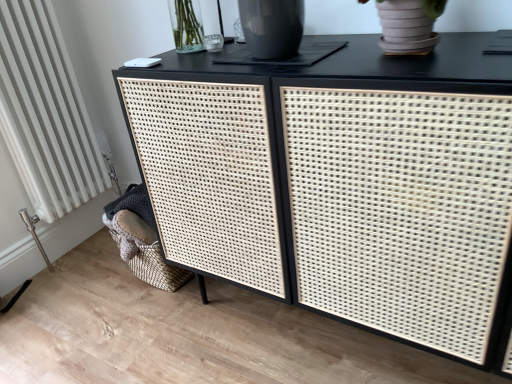
Image resolution: width=512 pixels, height=384 pixels. Describe the element at coordinates (341, 183) in the screenshot. I see `black woven cabinet at center` at that location.

Find the location of a particular element. This screenshot has width=512, height=384. black woven cabinet at center is located at coordinates (341, 183).

Measure the distance between point (481, 173) and camera.

They are 75.90 centimeters apart.

Where is `white textured radiator at lower left`? The width and height of the screenshot is (512, 384). white textured radiator at lower left is located at coordinates (45, 112).

The height and width of the screenshot is (384, 512). Describe the element at coordinates (45, 112) in the screenshot. I see `white textured radiator at lower left` at that location.

Find the location of `black woven cabinet at center`. black woven cabinet at center is located at coordinates (341, 183).

Which is more to the right, white textured radiator at lower left or black woven cabinet at center?

black woven cabinet at center.

Relative to black woven cabinet at center, is white textured radiator at lower left in front or behind?

white textured radiator at lower left is behind black woven cabinet at center.

Is point (68, 209) positioned before point (385, 61)?

No.

From the image's perspective, is white textured radiator at lower left over black woven cabinet at center?

Yes, from the image's perspective, white textured radiator at lower left is over black woven cabinet at center.

From the picture: From a real-world perspective, is white textured radiator at lower left above or below black woven cabinet at center?

Clearly, from a real-world perspective, white textured radiator at lower left is above black woven cabinet at center.

Considering the relative sizes of white textured radiator at lower left and black woven cabinet at center in the image provided, is white textured radiator at lower left wider than black woven cabinet at center?

In fact, white textured radiator at lower left might be narrower than black woven cabinet at center.

Does white textured radiator at lower left have a greater height compared to black woven cabinet at center?

Indeed, white textured radiator at lower left has a greater height compared to black woven cabinet at center.

Between white textured radiator at lower left and black woven cabinet at center, which one has smaller size?

Smaller between the two is white textured radiator at lower left.

Consider the image. Is white textured radiator at lower left surrounding black woven cabinet at center?

That's incorrect, black woven cabinet at center is not inside white textured radiator at lower left.

Is white textured radiator at lower left far away from black woven cabinet at center?

No.

Is white textured radiator at lower left aimed at black woven cabinet at center?

Yes, white textured radiator at lower left is turned towards black woven cabinet at center.

What's the angular difference between white textured radiator at lower left and black woven cabinet at center's facing directions?

There is a 90.5-degree angle between the facing directions of white textured radiator at lower left and black woven cabinet at center.

Where is `table below the white textured radiator at lower left (from a real-world perspective)`? This screenshot has width=512, height=384. table below the white textured radiator at lower left (from a real-world perspective) is located at coordinates (341, 183).

Based on the photo, considering the relative positions of black woven cabinet at center and white textured radiator at lower left in the image provided, is black woven cabinet at center to the right of white textured radiator at lower left from the viewer's perspective?

Yes, black woven cabinet at center is to the right of white textured radiator at lower left.

Relative to white textured radiator at lower left, is black woven cabinet at center in front or behind?

Visually, black woven cabinet at center is located in front of white textured radiator at lower left.

Which is behind, point (481, 196) or point (74, 88)?

The point (74, 88) is more distant.

From the picture: From the image's perspective, does black woven cabinet at center appear lower than white textured radiator at lower left?

Indeed, from the image's perspective, black woven cabinet at center is shown beneath white textured radiator at lower left.

Based on the photo, from a real-world perspective, is black woven cabinet at center positioned under white textured radiator at lower left based on gravity?

Correct, in the physical world, black woven cabinet at center is lower than white textured radiator at lower left.

Is black woven cabinet at center thinner than white textured radiator at lower left?

In fact, black woven cabinet at center might be wider than white textured radiator at lower left.

Does black woven cabinet at center have a greater height compared to white textured radiator at lower left?

No.

Considering the relative sizes of black woven cabinet at center and white textured radiator at lower left in the image provided, is black woven cabinet at center bigger than white textured radiator at lower left?

Yes.

Could white textured radiator at lower left be considered to be inside black woven cabinet at center?

No.

Is black woven cabinet at center in contact with white textured radiator at lower left?

No, black woven cabinet at center is not with white textured radiator at lower left.

Is black woven cabinet at center looking in the opposite direction of white textured radiator at lower left?

black woven cabinet at center does not have its back to white textured radiator at lower left.

What's the angular difference between black woven cabinet at center and white textured radiator at lower left's facing directions?

The angle between the facing direction of black woven cabinet at center and the facing direction of white textured radiator at lower left is 90.5 degrees.

The width and height of the screenshot is (512, 384). I want to click on radiator above the black woven cabinet at center (from the image's perspective), so click(x=45, y=112).

This screenshot has height=384, width=512. In the image, there is a white textured radiator at lower left. Find the location of `table below it (from the image's perspective)`. table below it (from the image's perspective) is located at coordinates (341, 183).

You are a GUI agent. You are given a task and a screenshot of the screen. Output one action in this format:
    pyautogui.click(x=<x>, y=<y>)
    Task: Click on the table that is in front of the white textured radiator at lower left
    Image resolution: width=512 pixels, height=384 pixels.
    Given the screenshot: What is the action you would take?
    (x=341, y=183)